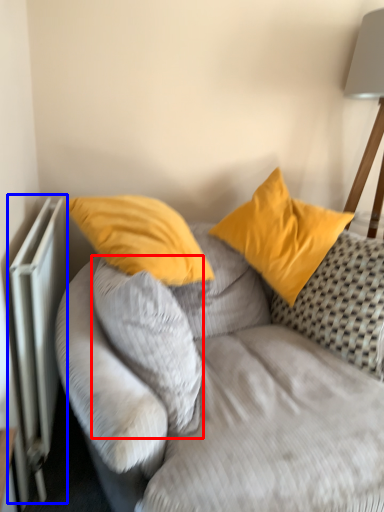
Question: Among these objects, which one is nearest to the camera, pillow (highlighted by a red box) or radiator (highlighted by a blue box)?

Choices:
 (A) pillow
 (B) radiator

Answer: (A)